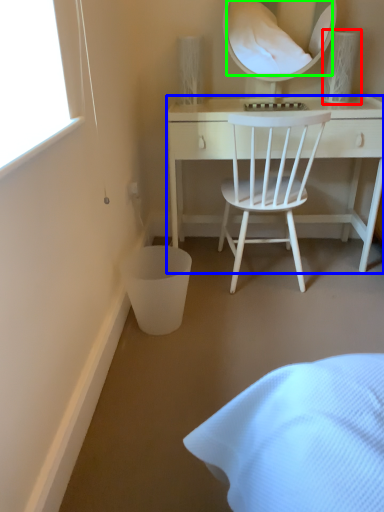
Question: Estimate the real-world distances between objects in this image. Which object is closer to table lamp (highlighted by a red box), desk (highlighted by a blue box) or mirror (highlighted by a green box)?

Choices:
 (A) desk
 (B) mirror

Answer: (A)